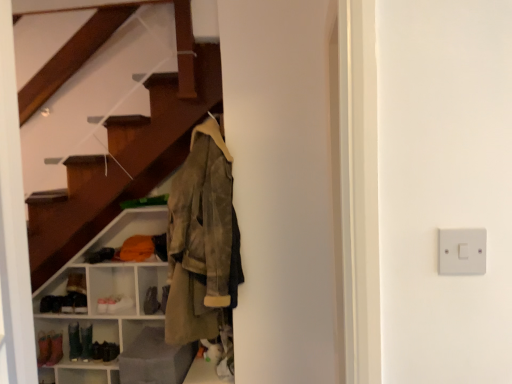
Question: Does leather shoe at lower left turn towards olive suede jacket at center?

Choices:
 (A) yes
 (B) no

Answer: (B)

Question: Does leather shoe at lower left lie behind olive suede jacket at center?

Choices:
 (A) no
 (B) yes

Answer: (B)

Question: Is olive suede jacket at center at the back of leather shoe at lower left?

Choices:
 (A) no
 (B) yes

Answer: (A)

Question: From a real-world perspective, is leather shoe at lower left physically below olive suede jacket at center?

Choices:
 (A) no
 (B) yes

Answer: (B)

Question: Is leather shoe at lower left positioned far away from olive suede jacket at center?

Choices:
 (A) yes
 (B) no

Answer: (A)

Question: Is white plastic switch at right wider or thinner than matte gray ottoman at lower left?

Choices:
 (A) wide
 (B) thin

Answer: (B)

Question: From a real-world perspective, is white plastic switch at right positioned above or below matte gray ottoman at lower left?

Choices:
 (A) above
 (B) below

Answer: (A)

Question: Relative to matte gray ottoman at lower left, is white plastic switch at right in front or behind?

Choices:
 (A) front
 (B) behind

Answer: (A)

Question: Considering the positions of point (443, 274) and point (174, 355), is point (443, 274) closer or farther from the camera than point (174, 355)?

Choices:
 (A) farther
 (B) closer

Answer: (B)

Question: Visually, is olive suede jacket at center positioned to the left or to the right of leather shoe at lower left?

Choices:
 (A) right
 (B) left

Answer: (A)

Question: Considering the positions of olive suede jacket at center and leather shoe at lower left in the image, is olive suede jacket at center bigger or smaller than leather shoe at lower left?

Choices:
 (A) big
 (B) small

Answer: (A)

Question: Do you think olive suede jacket at center is within leather shoe at lower left, or outside of it?

Choices:
 (A) outside
 (B) inside

Answer: (A)

Question: Does point (202, 178) appear closer or farther from the camera than point (150, 289)?

Choices:
 (A) farther
 (B) closer

Answer: (B)

Question: Considering their positions, is leather shoe at lower left located in front of or behind white plastic switch at right?

Choices:
 (A) front
 (B) behind

Answer: (B)

Question: Looking at the image, does leather shoe at lower left seem bigger or smaller compared to white plastic switch at right?

Choices:
 (A) small
 (B) big

Answer: (B)